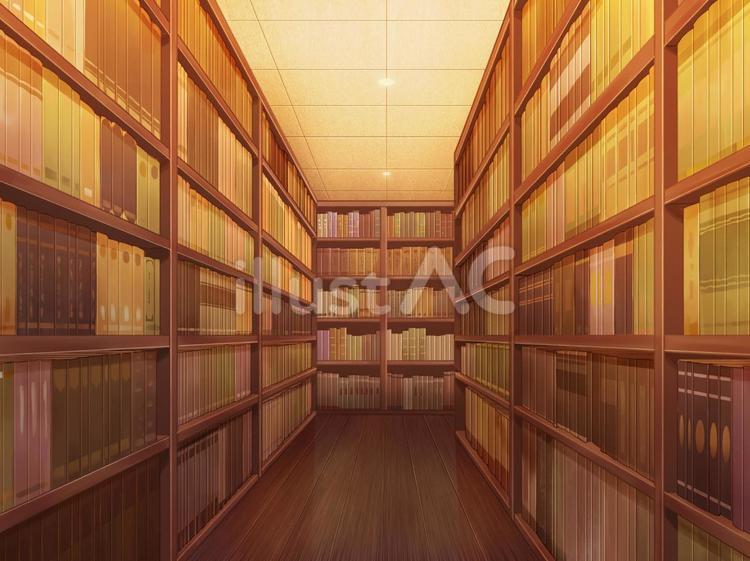
Where is `shortest books on shelf`? The height and width of the screenshot is (561, 750). shortest books on shelf is located at coordinates (150, 283), (355, 339), (357, 341), (343, 381), (346, 392), (405, 381), (408, 385), (434, 383), (439, 388), (462, 357).